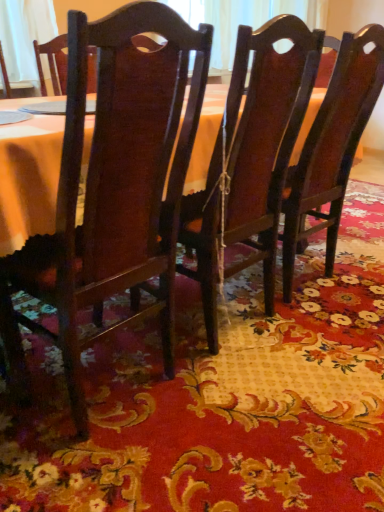
You are a GUI agent. You are given a task and a screenshot of the screen. Output one action in this format:
    pyautogui.click(x=<x>, y=<y>)
    Task: Click on the free location to the right of matte wood chair at center, which ranks as the 1th chair in left-to-right order
    Image resolution: width=384 pixels, height=512 pixels.
    Given the screenshot: What is the action you would take?
    pyautogui.click(x=254, y=412)